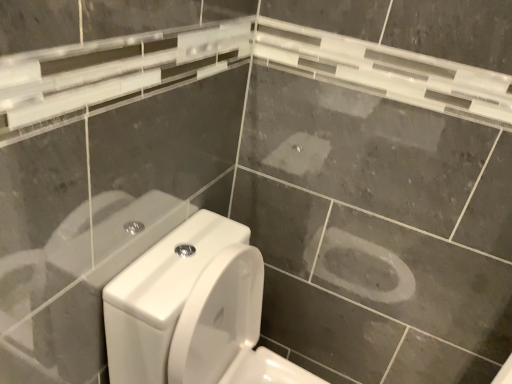
What do you see at coordinates (193, 311) in the screenshot?
I see `white glossy sink at lower left` at bounding box center [193, 311].

The width and height of the screenshot is (512, 384). Identify the location of white glossy sink at lower left. (193, 311).

The image size is (512, 384). What are the coordinates of `white glossy sink at lower left` in the screenshot? It's located at (193, 311).